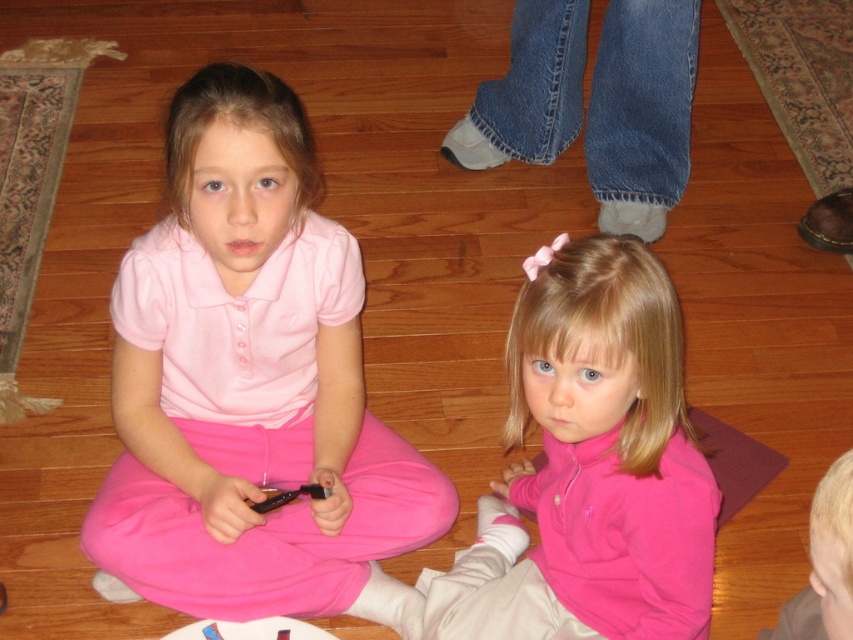
Between matte pink shirt at center and denim jeans at upper center, which one has more height?

With more height is matte pink shirt at center.

Who is more distant from viewer, (178, 93) or (618, 28)?

The point (618, 28) is behind.

Who is more forward, (173, 198) or (694, 38)?

Point (173, 198)

The width and height of the screenshot is (853, 640). What are the coordinates of `matte pink shirt at center` in the screenshot? It's located at (251, 387).

Looking at this image, between pink fleece jacket at lower center and denim jeans at upper center, which one appears on the left side from the viewer's perspective?

pink fleece jacket at lower center

This screenshot has height=640, width=853. What do you see at coordinates (590, 465) in the screenshot?
I see `pink fleece jacket at lower center` at bounding box center [590, 465].

Describe the element at coordinates (590, 465) in the screenshot. I see `pink fleece jacket at lower center` at that location.

Image resolution: width=853 pixels, height=640 pixels. Identify the location of pink fleece jacket at lower center. (590, 465).

Does matte pink shirt at center lie behind pink fleece jacket at lower center?

That is True.

From the picture: Does matte pink shirt at center appear on the right side of pink fleece jacket at lower center?

No, matte pink shirt at center is not to the right of pink fleece jacket at lower center.

You are a GUI agent. You are given a task and a screenshot of the screen. Output one action in this format:
    pyautogui.click(x=<x>, y=<y>)
    Task: Click on the matte pink shirt at center
    This screenshot has height=640, width=853.
    Given the screenshot: What is the action you would take?
    pyautogui.click(x=251, y=387)